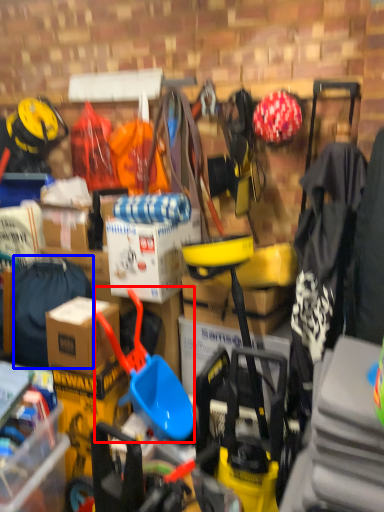
Question: Which object is closer to the camera taking this photo, shovel (highlighted by a red box) or clothing (highlighted by a blue box)?

Choices:
 (A) shovel
 (B) clothing

Answer: (A)